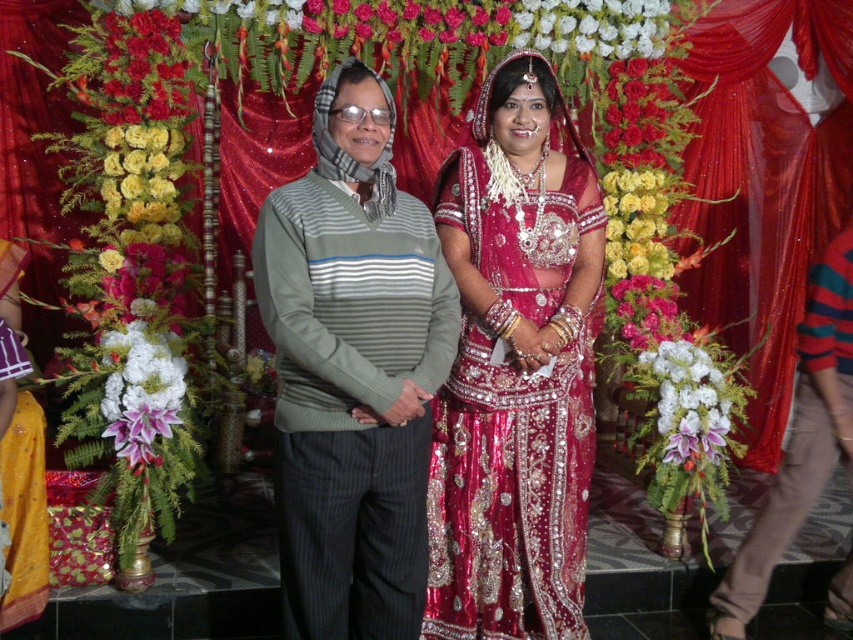
Question: Is shiny silk lehenga at center closer to camera compared to yellow silk flowers at left?

Choices:
 (A) yes
 (B) no

Answer: (A)

Question: From the image, what is the correct spatial relationship of shiny silk saree at center in relation to shiny silk lehenga at center?

Choices:
 (A) below
 (B) above

Answer: (B)

Question: Among these points, which one is farthest from the camera?

Choices:
 (A) (434, 324)
 (B) (575, 464)

Answer: (B)

Question: Which point is closer to the camera?

Choices:
 (A) white matte flowers at center
 (B) white floral garland at upper center

Answer: (A)

Question: From the image, what is the correct spatial relationship of shiny red petals at upper left in relation to shiny red petals at upper right?

Choices:
 (A) left
 (B) right

Answer: (A)

Question: Which of the following is the closest to the observer?

Choices:
 (A) (128, 164)
 (B) (131, 374)
 (C) (666, 80)
 (D) (700, 410)

Answer: (B)